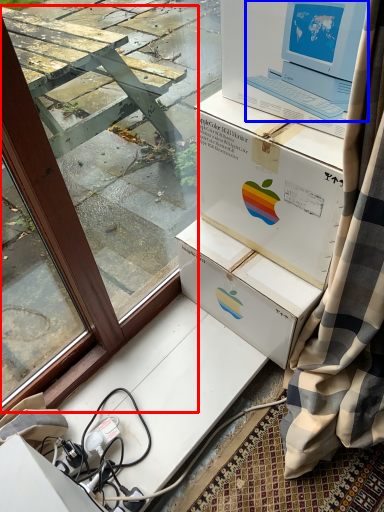
Question: Which of the following is the closest to the observer, window frame (highlighted by a red box) or laptop (highlighted by a blue box)?

Choices:
 (A) window frame
 (B) laptop

Answer: (A)